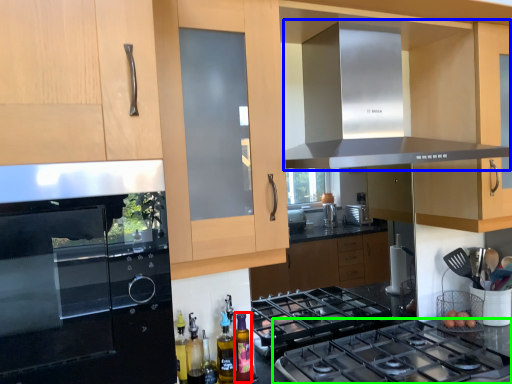
Question: Which object is the farthest from bottle (highlighted by a red box)? Choose among these: exhaust hood (highlighted by a blue box) or gas stove (highlighted by a green box).

Choices:
 (A) exhaust hood
 (B) gas stove

Answer: (A)